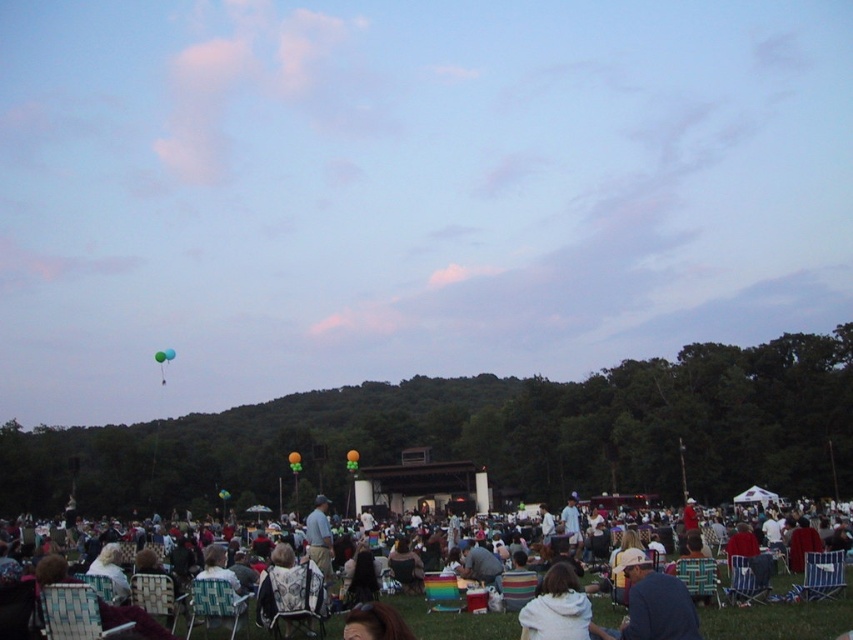
You are a photographer at the event and want to ensure both the white striped shirt at center and the gray fabric shirt at center are fully visible in your photo. Which shirt should you focus on to avoid cropping the top of the image?

You should focus on the gray fabric shirt at center because it is taller than the white striped shirt at center, so ensuring it fits will also accommodate the shorter shirt.

You are an event organizer who needs to ensure that all attendees have a clear view of the stage. You notice two shirts at the center of the crowd, a white striped shirt at center and a gray fabric shirt at center. Which shirt is blocking the view of the other?

The white striped shirt at center is positioned over the gray fabric shirt at center, so it is blocking the view of the gray fabric shirt at center.

You are at the outdoor event and see the gray fabric shirt at center and the blue glossy balloon at upper center. Which object is positioned to the right of the other?

The gray fabric shirt at center is to the right of the blue glossy balloon at upper center.